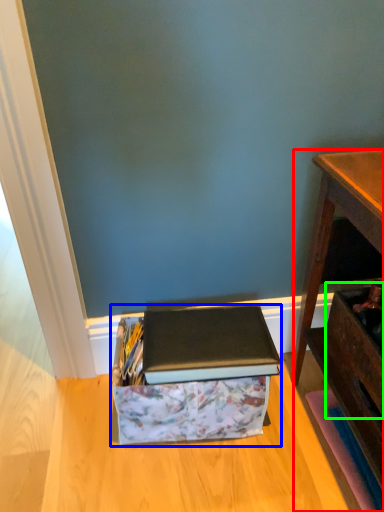
Question: Which object is positioned closest to desk (highlighted by a red box)? Select from storage box (highlighted by a blue box) and drawer (highlighted by a green box).

Choices:
 (A) storage box
 (B) drawer

Answer: (B)